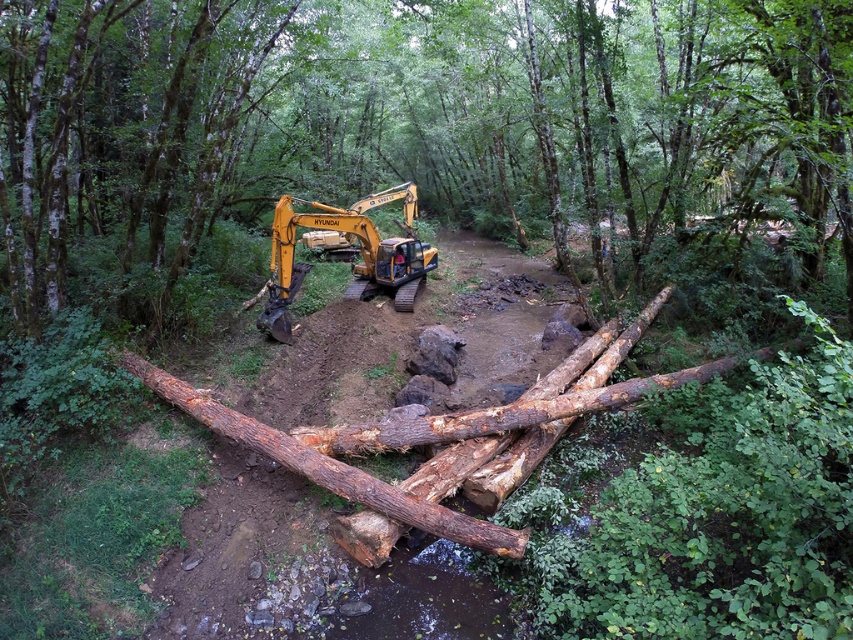
You are standing at the point marked as point (419, 122) in the forest scene. What object are you directly facing?

The point (419, 122) corresponds to the rough wooden log at center, so you are directly facing the rough wooden log at center.

You are a construction worker standing at the edge of the stream. You need to move the yellow metallic excavator at center to the other side of the stream. Can you drive it over the rough wooden log at center? Why or why not?

The rough wooden log at center is positioned on the right side of the yellow metallic excavator at center. Since the log is located to the right of the excavator, it is not directly in the path of driving the excavator across the stream. However, the stability and load capacity of the log must be considered. If the log is sturdy enough to support the excavator, it could potentially be used as a makeshift bridge. Otherwise, driving over it might cause it to break, leading to safety risks.

Consider the image. You are a construction worker who needs to move the yellow metallic excavator at center to a different location. Can you move it directly without moving the rough wooden log at center first?

The rough wooden log at center is positioned over the yellow metallic excavator at center, so you must move the rough wooden log at center first before moving the yellow metallic excavator at center.